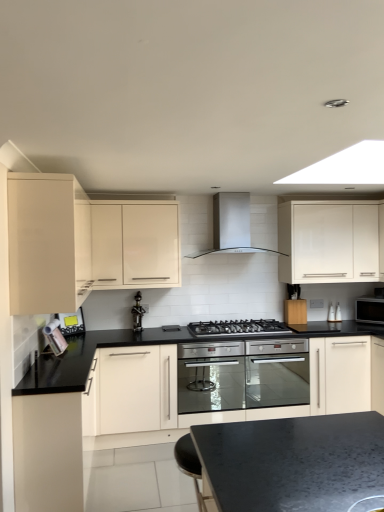
Question: Which direction should I rotate to look at white glossy cabinet at upper center, the second cabinetry in the right-to-left sequence?

Choices:
 (A) left
 (B) right

Answer: (A)

Question: Does black matte gas stove at center come in front of metallic silver toaster at lower left, the 3th appliance viewed from the back?

Choices:
 (A) no
 (B) yes

Answer: (B)

Question: Is black matte gas stove at center outside metallic silver toaster at lower left, which is the 1th appliance in front-to-back order?

Choices:
 (A) yes
 (B) no

Answer: (A)

Question: From the image's perspective, is black matte gas stove at center on top of metallic silver toaster at lower left, the 3th appliance viewed from the back?

Choices:
 (A) no
 (B) yes

Answer: (A)

Question: Can you confirm if black matte gas stove at center is smaller than metallic silver toaster at lower left, the 3th appliance viewed from the back?

Choices:
 (A) yes
 (B) no

Answer: (B)

Question: From the image's perspective, is black matte gas stove at center located beneath metallic silver toaster at lower left, positioned as the 3th appliance in right-to-left order?

Choices:
 (A) yes
 (B) no

Answer: (A)

Question: Would you say black matte gas stove at center contains metallic silver toaster at lower left, positioned as the 3th appliance in right-to-left order?

Choices:
 (A) no
 (B) yes

Answer: (A)

Question: Is metallic silver toaster at lower left, the 1th appliance viewed from the left, facing towards satin silver range hood at center?

Choices:
 (A) no
 (B) yes

Answer: (A)

Question: Would you consider metallic silver toaster at lower left, which is the 1th appliance in front-to-back order, to be distant from satin silver range hood at center?

Choices:
 (A) yes
 (B) no

Answer: (A)

Question: Considering the relative positions of metallic silver toaster at lower left, the 1th appliance viewed from the left, and satin silver range hood at center in the image provided, is metallic silver toaster at lower left, the 1th appliance viewed from the left, to the right of satin silver range hood at center from the viewer's perspective?

Choices:
 (A) no
 (B) yes

Answer: (A)

Question: Can you confirm if metallic silver toaster at lower left, positioned as the 3th appliance in right-to-left order, is smaller than satin silver range hood at center?

Choices:
 (A) yes
 (B) no

Answer: (A)

Question: Does metallic silver toaster at lower left, positioned as the 3th appliance in right-to-left order, have a lesser width compared to satin silver range hood at center?

Choices:
 (A) yes
 (B) no

Answer: (A)

Question: From a real-world perspective, is metallic silver toaster at lower left, which is the 1th appliance in front-to-back order, on top of satin silver range hood at center?

Choices:
 (A) no
 (B) yes

Answer: (A)

Question: From a real-world perspective, is black matte gas stove at center on black glass microwave at right, which is counted as the first appliance, starting from the right?

Choices:
 (A) no
 (B) yes

Answer: (A)